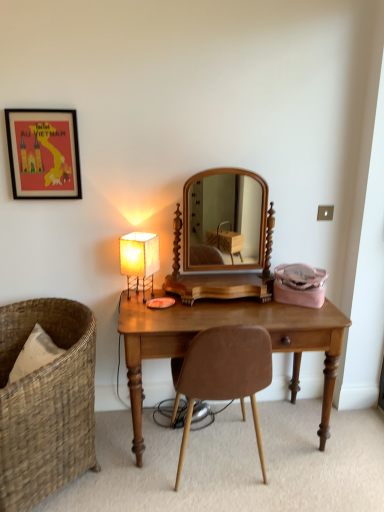
Locate an element on the screen. vacant area located to the right-hand side of white paper lampshade at left is located at coordinates (182, 302).